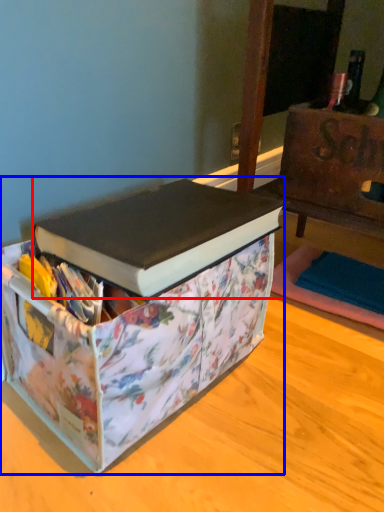
Question: Which object is further to the camera taking this photo, book (highlighted by a red box) or box (highlighted by a blue box)?

Choices:
 (A) book
 (B) box

Answer: (A)